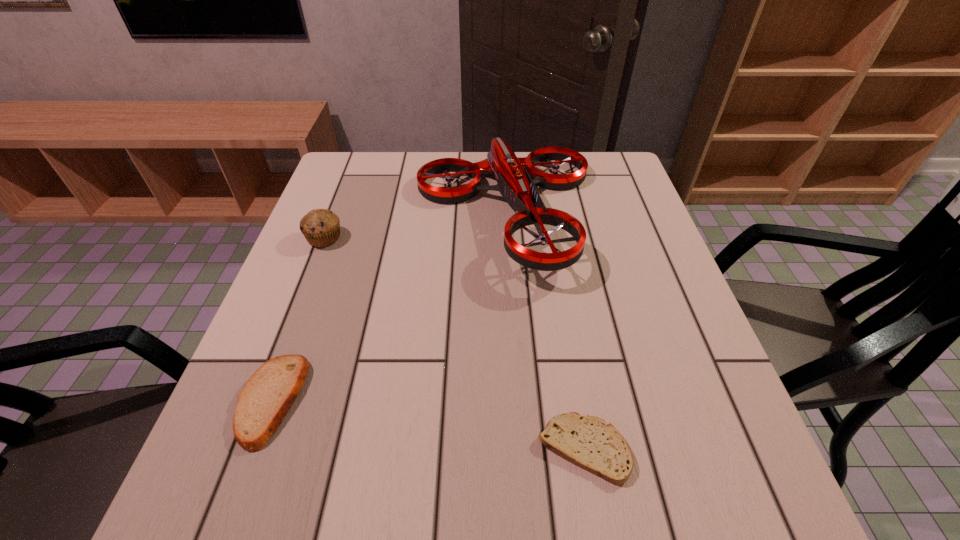
The height and width of the screenshot is (540, 960). I want to click on free space between the left pita bread and the third shortest object, so click(298, 319).

I want to click on free space between the shorter pita bread and the third shortest object, so click(x=454, y=343).

Locate an element on the screen. The width and height of the screenshot is (960, 540). empty location between the third tallest object and the shortest object is located at coordinates (428, 424).

Find the location of a particular element. vacant point located between the tallest object and the muffin is located at coordinates (415, 226).

Identify the location of empty space between the tallest object and the left pita bread. (389, 307).

Where is `vacant region between the drone and the taller pita bread`? This screenshot has height=540, width=960. vacant region between the drone and the taller pita bread is located at coordinates (389, 307).

Where is `vacant point located between the shortest object and the muffin`? This screenshot has height=540, width=960. vacant point located between the shortest object and the muffin is located at coordinates (x=454, y=343).

At what (x,y) coordinates should I click in order to perform the action: click on unoccupied area between the muffin and the shortest object. Please return your answer as a coordinate pair (x, y). Image resolution: width=960 pixels, height=540 pixels. Looking at the image, I should click on (454, 343).

This screenshot has height=540, width=960. In order to click on blank region between the right pita bread and the tallest object in this screenshot , I will do `click(544, 330)`.

This screenshot has height=540, width=960. I want to click on vacant area between the left pita bread and the drone, so click(x=389, y=307).